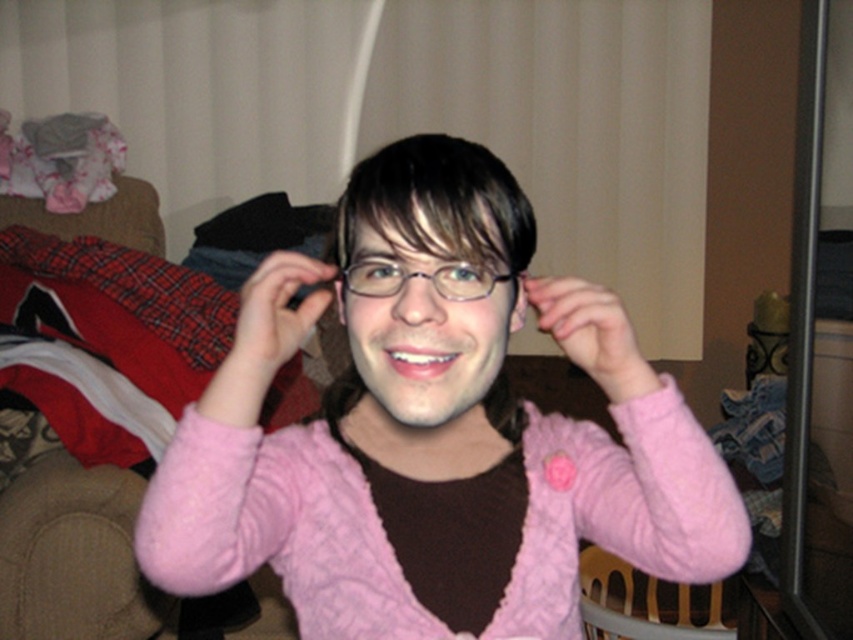
You are standing in the room and want to pick up the pink fuzzy sweater at center and the wooden armchair at lower right. Which object is easier to reach without moving your current position?

The pink fuzzy sweater at center is closer to the viewer, so it is easier to reach without moving your current position.

You are a delivery robot that is 18 inches wide. You need to move from the entrance to the pink fuzzy sweater at center in the living room. Is there enough space for you to pass through the narrowest part of the path?

The distance of pink fuzzy sweater at center from viewer is 24.39 inches. Since the robot is 18 inches wide, there is enough space for it to pass through the narrowest part of the path as 24.39 inches is greater than 18 inches.

In the scene shown: You are trying to decide which sweater to wear today. You have a pink fuzzy sweater at center and a matte pink sweater at center in front of you. Which one would you choose if you want the larger one?

The pink fuzzy sweater at center is bigger than the matte pink sweater at center, so you should choose the pink fuzzy sweater at center.